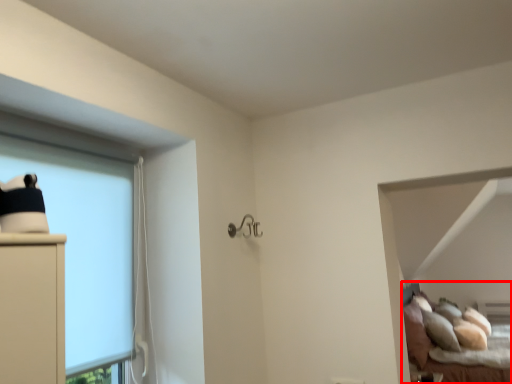
Question: From the image's perspective, what is the correct spatial positioning of bed (annotated by the red box) in reference to bay window?

Choices:
 (A) below
 (B) above

Answer: (A)